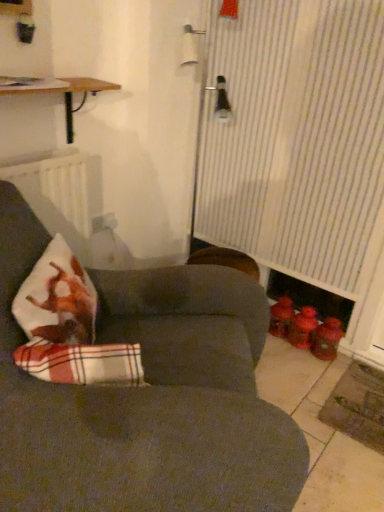
Question: From a real-world perspective, is plaid fabric cushion at lower left located higher than wooden shelf at upper left?

Choices:
 (A) yes
 (B) no

Answer: (B)

Question: Is plaid fabric cushion at lower left positioned beyond the bounds of wooden shelf at upper left?

Choices:
 (A) no
 (B) yes

Answer: (B)

Question: Is plaid fabric cushion at lower left behind wooden shelf at upper left?

Choices:
 (A) yes
 (B) no

Answer: (B)

Question: Does plaid fabric cushion at lower left have a smaller size compared to wooden shelf at upper left?

Choices:
 (A) no
 (B) yes

Answer: (B)

Question: Considering the relative sizes of plaid fabric cushion at lower left and wooden shelf at upper left in the image provided, is plaid fabric cushion at lower left thinner than wooden shelf at upper left?

Choices:
 (A) no
 (B) yes

Answer: (B)

Question: Is plaid fabric cushion at lower left positioned far away from wooden shelf at upper left?

Choices:
 (A) yes
 (B) no

Answer: (B)

Question: Does wooden shelf at upper left have a larger size compared to white striped curtain at right?

Choices:
 (A) yes
 (B) no

Answer: (B)

Question: Is wooden shelf at upper left wider than white striped curtain at right?

Choices:
 (A) no
 (B) yes

Answer: (B)

Question: Does wooden shelf at upper left have a smaller size compared to white striped curtain at right?

Choices:
 (A) yes
 (B) no

Answer: (A)

Question: Is the position of wooden shelf at upper left less distant than that of white striped curtain at right?

Choices:
 (A) no
 (B) yes

Answer: (B)

Question: Are wooden shelf at upper left and white striped curtain at right making contact?

Choices:
 (A) yes
 (B) no

Answer: (B)

Question: Is wooden shelf at upper left not within white striped curtain at right?

Choices:
 (A) yes
 (B) no

Answer: (A)

Question: From the image's perspective, is wooden shelf at upper left above dark gray fabric couch at center?

Choices:
 (A) no
 (B) yes

Answer: (B)